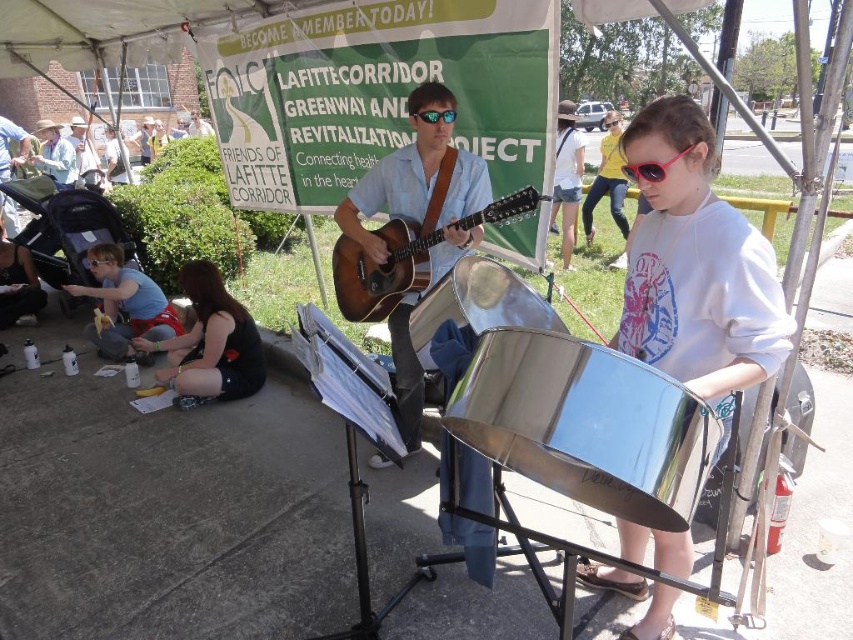
You are a photographer at this event and want to capture both the metallic steel drum at center and the matte brown acoustic guitar at center in a single shot. Considering their heights, which instrument should you focus on to ensure both are fully visible in the frame?

The metallic steel drum at center is much taller than the matte brown acoustic guitar at center. To ensure both are fully visible, focus on the metallic steel drum at center as it is the taller instrument and adjust the camera angle accordingly.

You are a photographer at the event and want to take a photo of the shiny metallic drum at center and the matte blue shirt at lower left. Which object should you focus on first to ensure both are in the frame?

The shiny metallic drum at center is in front of the matte blue shirt at lower left, so you should focus on the shiny metallic drum at center first to ensure both are in the frame.